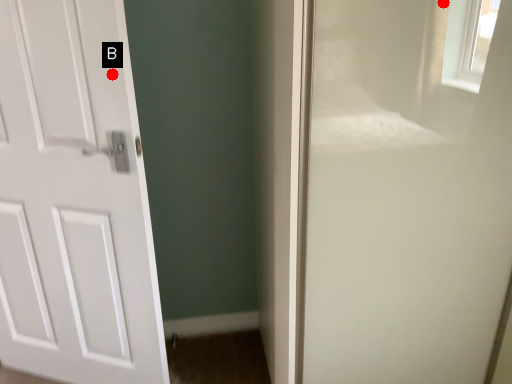
Question: Two points are circled on the image, labeled by A and B beside each circle. Which point is closer to the camera?

Choices:
 (A) A is closer
 (B) B is closer

Answer: (A)